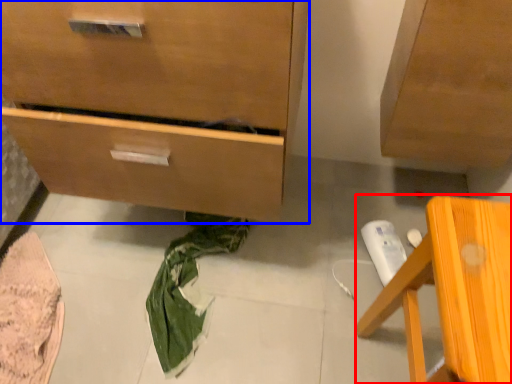
Question: Which point is further to the camera, furniture (highlighted by a red box) or chest of drawers (highlighted by a blue box)?

Choices:
 (A) furniture
 (B) chest of drawers

Answer: (B)